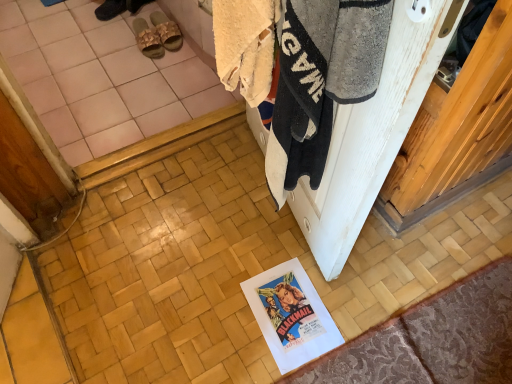
Where is `free area in between white wood screen door at upper right and white paper at lower center`? The image size is (512, 384). free area in between white wood screen door at upper right and white paper at lower center is located at coordinates (274, 251).